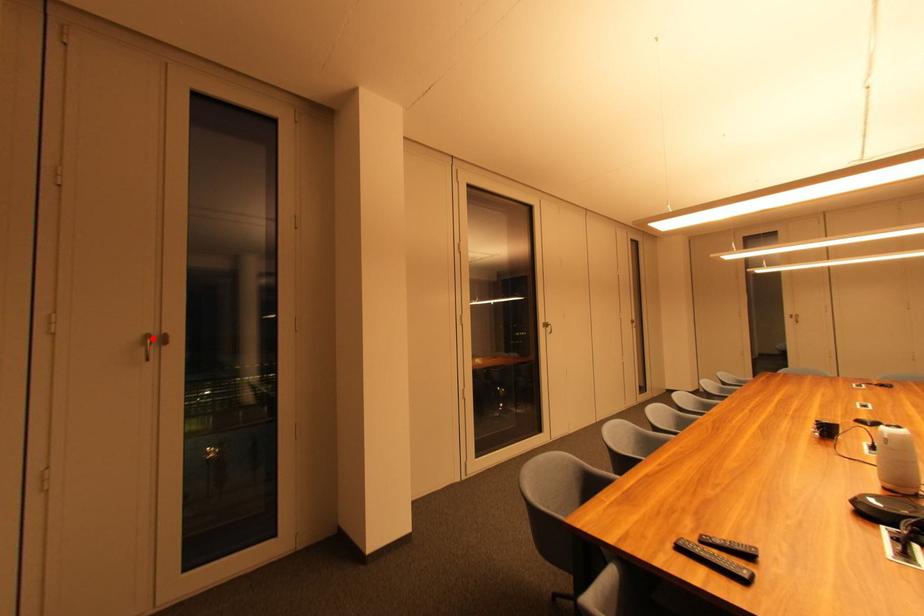
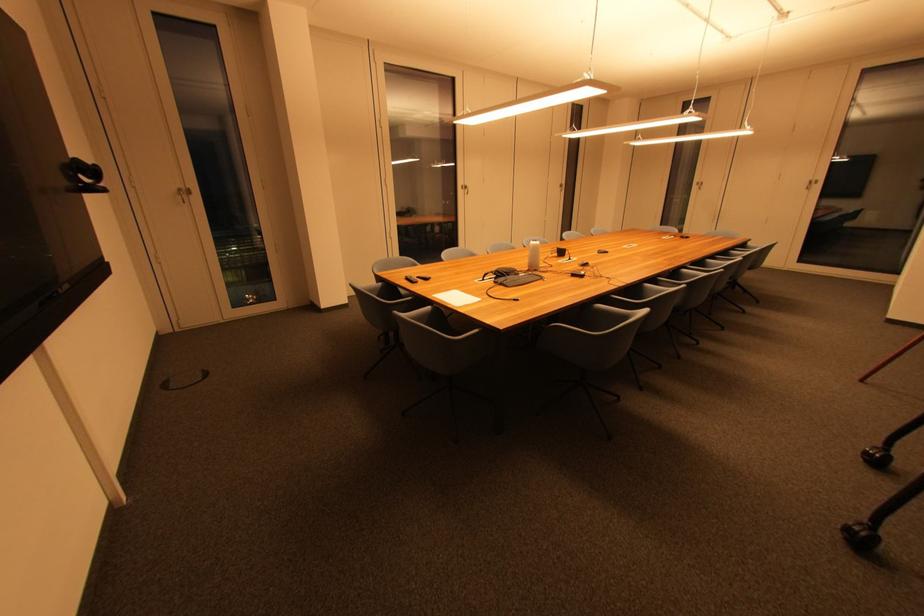
In the second image, find the point that corresponds to the highlighted location in the first image.

(185, 192)